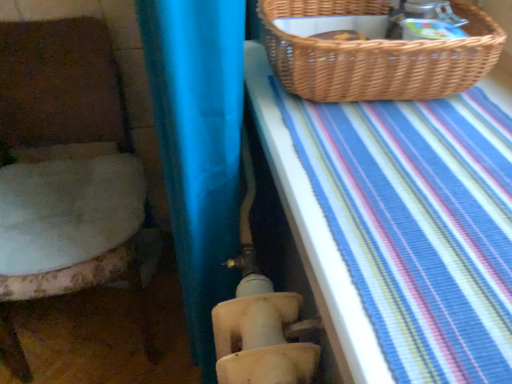
Identify the location of vacant space in front of woven brown picnic basket at upper right. (398, 178).